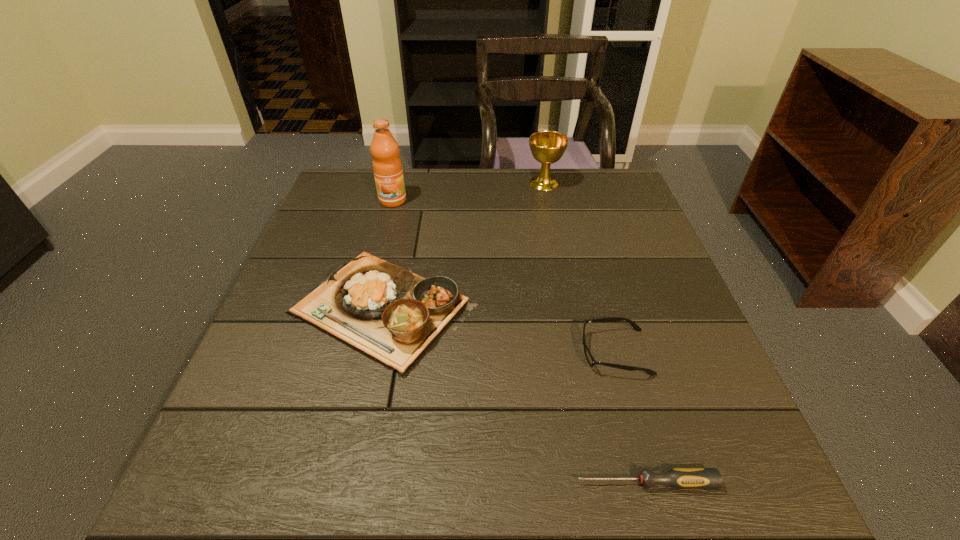
Where is `object situated at the left edge`? object situated at the left edge is located at coordinates (393, 315).

Where is `spectacles located at the right edge`? This screenshot has width=960, height=540. spectacles located at the right edge is located at coordinates (591, 361).

Locate an element on the screen. This screenshot has height=540, width=960. screwdriver situated at the right edge is located at coordinates (678, 478).

You are a GUI agent. You are given a task and a screenshot of the screen. Output one action in this format:
    pyautogui.click(x=<x>, y=<y>)
    Task: Click on the object at the near right corner
    
    Given the screenshot: What is the action you would take?
    pyautogui.click(x=678, y=478)

This screenshot has width=960, height=540. Identify the location of vacant space at the far edge. (555, 206).

In the image, there is a desktop. Identify the location of vacant space at the near edge. This screenshot has width=960, height=540. coord(544,489).

I want to click on free point at the left edge, so click(x=343, y=251).

The image size is (960, 540). In the image, there is a desktop. In order to click on free space at the right edge in this screenshot , I will do [x=674, y=386].

This screenshot has width=960, height=540. In the image, there is a desktop. Identify the location of vacant region at the far left corner. pos(352,171).

In order to click on vacant space at the near left corner of the desktop in this screenshot , I will do `click(289, 488)`.